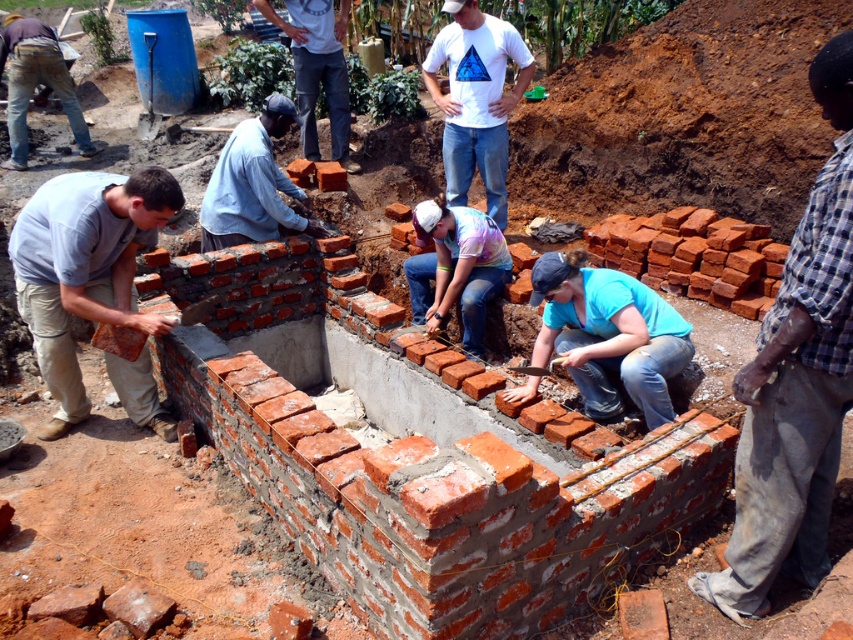
Question: In this image, where is matte gray brick at left located relative to matte brick wall at center?

Choices:
 (A) right
 (B) left

Answer: (B)

Question: Among these points, which one is farthest from the camera?

Choices:
 (A) (279, 176)
 (B) (198, 280)

Answer: (A)

Question: Which object appears closest to the camera in this image?

Choices:
 (A) light blue shirt at center
 (B) red brick wall at center

Answer: (B)

Question: Which object is farther from the camera taking this photo?

Choices:
 (A) checkered fabric shirt at right
 (B) light blue shirt at center
 (C) red brick wall at center
 (D) white matte t-shirt at center

Answer: (D)

Question: Can you confirm if white matte t-shirt at center is positioned to the right of light blue shirt at center?

Choices:
 (A) no
 (B) yes

Answer: (B)

Question: Does matte gray brick at left appear on the right side of matte brown shirt at upper left?

Choices:
 (A) yes
 (B) no

Answer: (A)